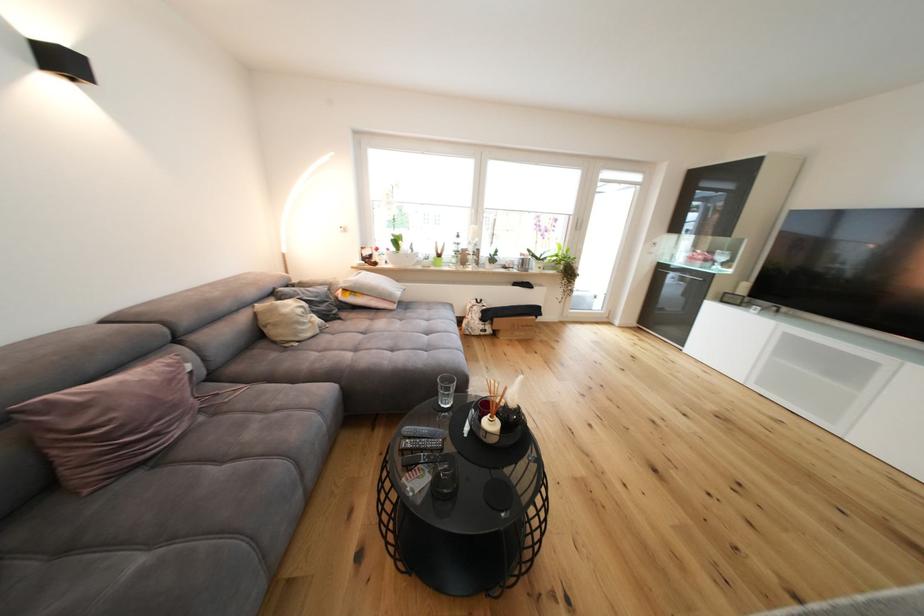
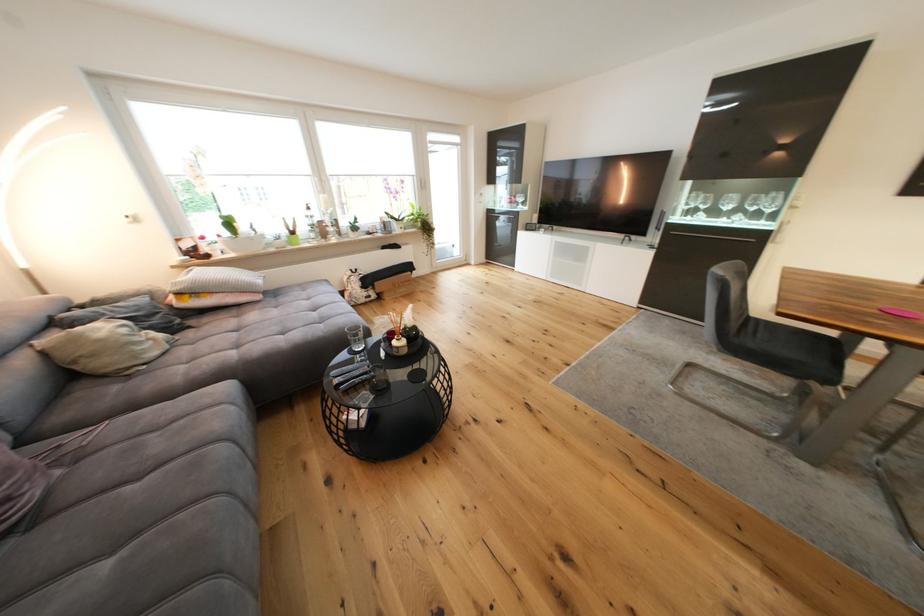
Locate, in the second image, the point that corresponds to [489,329] in the first image.

(372, 296)